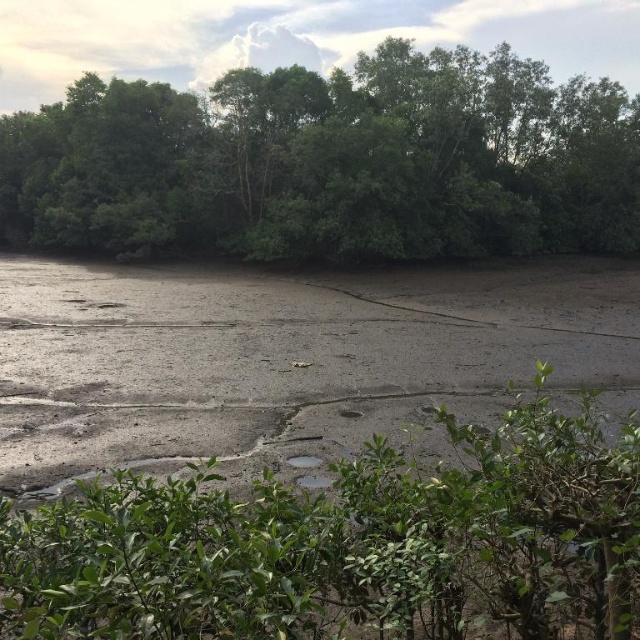
From the picture: Can you confirm if green leafy trees at upper center is smaller than green leafy bush at center?

Incorrect, green leafy trees at upper center is not smaller in size than green leafy bush at center.

Does green leafy trees at upper center lie behind green leafy bush at center?

That is True.

Who is more distant from viewer, (76, 177) or (438, 497)?

The point (76, 177) is more distant.

In order to click on green leafy trees at upper center in this screenshot , I will do `click(330, 163)`.